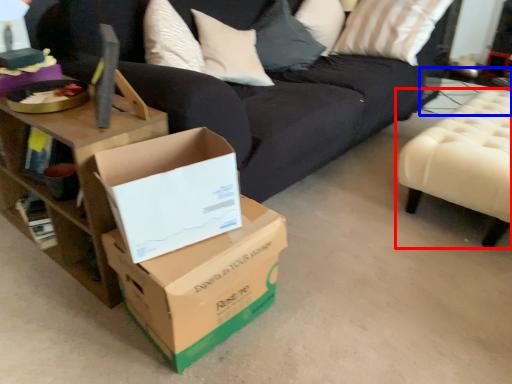
Question: Which object is closer to the camera taking this photo, furniture (highlighted by a red box) or side table (highlighted by a blue box)?

Choices:
 (A) furniture
 (B) side table

Answer: (A)